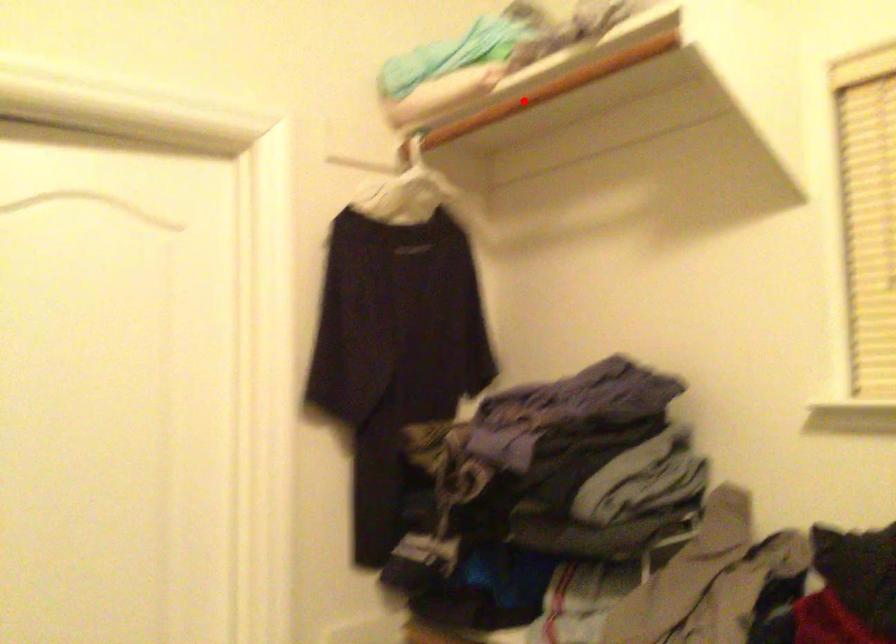
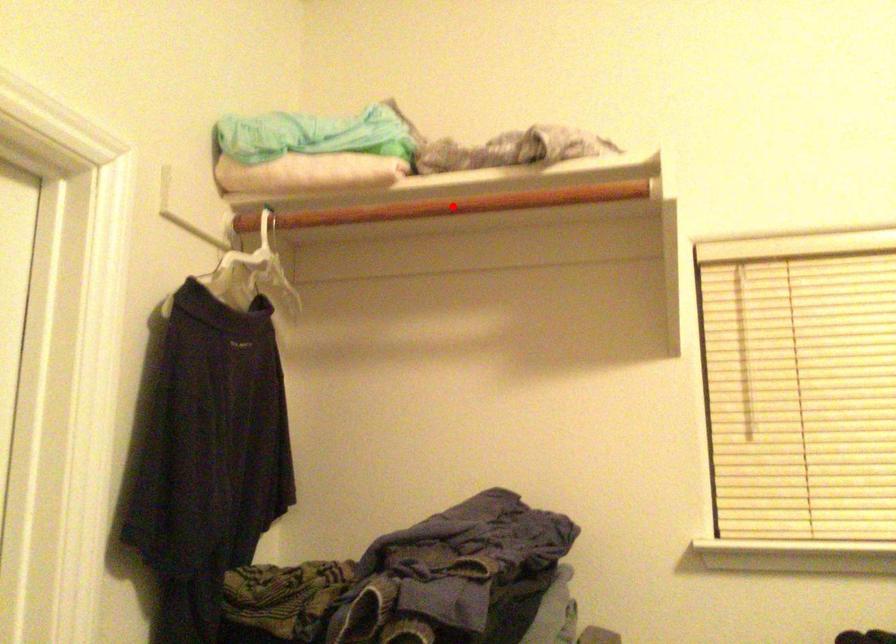
I am providing you with two images of the same scene from different viewpoints. A red point is marked on the first image and another point is marked on the second image. Is the marked point in image1 the same physical position as the marked point in image2?

Yes